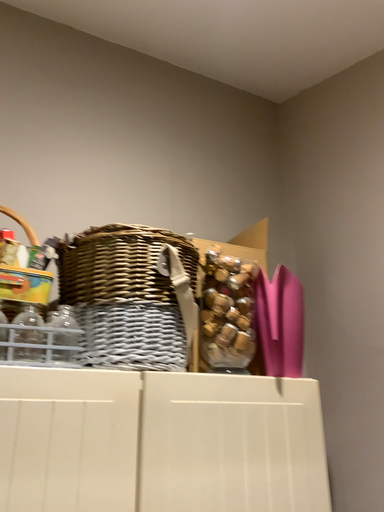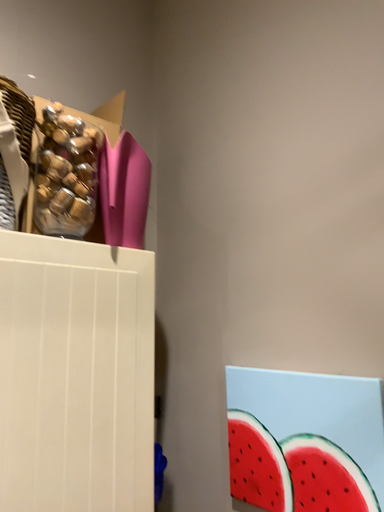
Question: How did the camera likely rotate when shooting the video?

Choices:
 (A) rotated left
 (B) rotated right

Answer: (B)